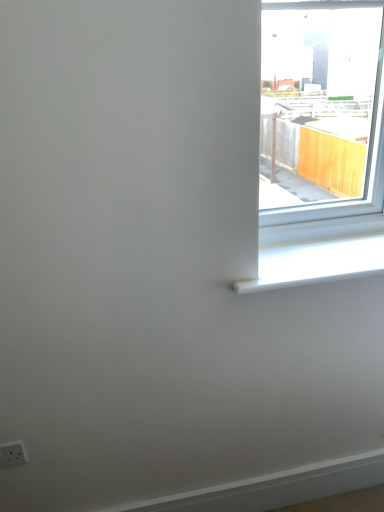
What do you see at coordinates (316, 262) in the screenshot? The image size is (384, 512). I see `white plastic window sill at upper right` at bounding box center [316, 262].

The image size is (384, 512). In order to click on white plastic window sill at upper right in this screenshot , I will do `click(316, 262)`.

This screenshot has height=512, width=384. What do you see at coordinates (12, 454) in the screenshot?
I see `white plastic electric outlet at lower left` at bounding box center [12, 454].

This screenshot has width=384, height=512. Find the location of `white plastic electric outlet at lower left`. white plastic electric outlet at lower left is located at coordinates (12, 454).

Where is `white plastic window sill at upper right`? The image size is (384, 512). white plastic window sill at upper right is located at coordinates (316, 262).

Considering the relative positions of white plastic window sill at upper right and white plastic electric outlet at lower left in the image provided, is white plastic window sill at upper right to the right of white plastic electric outlet at lower left from the viewer's perspective?

Indeed, white plastic window sill at upper right is positioned on the right side of white plastic electric outlet at lower left.

Who is more distant, white plastic window sill at upper right or white plastic electric outlet at lower left?

white plastic electric outlet at lower left is more distant.

Considering the positions of points (351, 241) and (21, 448), is point (351, 241) farther from camera compared to point (21, 448)?

Yes, it is.

From the image's perspective, which one is positioned higher, white plastic window sill at upper right or white plastic electric outlet at lower left?

white plastic window sill at upper right appears higher in the image.

Looking at this image, from a real-world perspective, is white plastic window sill at upper right on white plastic electric outlet at lower left?

Yes, from a real-world perspective, white plastic window sill at upper right is on top of white plastic electric outlet at lower left.

Which object is thinner, white plastic window sill at upper right or white plastic electric outlet at lower left?

white plastic electric outlet at lower left is thinner.

Considering the relative sizes of white plastic window sill at upper right and white plastic electric outlet at lower left in the image provided, is white plastic window sill at upper right shorter than white plastic electric outlet at lower left?

Yes.

Who is smaller, white plastic window sill at upper right or white plastic electric outlet at lower left?

white plastic electric outlet at lower left is smaller.

Is white plastic window sill at upper right not within white plastic electric outlet at lower left?

Indeed, white plastic window sill at upper right is completely outside white plastic electric outlet at lower left.

Is white plastic window sill at upper right beside white plastic electric outlet at lower left?

No, white plastic window sill at upper right is not making contact with white plastic electric outlet at lower left.

Is white plastic window sill at upper right aimed at white plastic electric outlet at lower left?

No, white plastic window sill at upper right is not facing towards white plastic electric outlet at lower left.

Can you tell me how much white plastic window sill at upper right and white plastic electric outlet at lower left differ in facing direction?

0.894 degrees.

Identify the location of electric outlet below the white plastic window sill at upper right (from a real-world perspective). This screenshot has height=512, width=384. (12, 454).

Considering the relative positions of white plastic electric outlet at lower left and white plastic window sill at upper right in the image provided, is white plastic electric outlet at lower left to the left or to the right of white plastic window sill at upper right?

Clearly, white plastic electric outlet at lower left is on the left of white plastic window sill at upper right in the image.

Considering the positions of objects white plastic electric outlet at lower left and white plastic window sill at upper right in the image provided, who is in front, white plastic electric outlet at lower left or white plastic window sill at upper right?

white plastic window sill at upper right is closer to the camera.

In the scene shown: Which is closer to the camera, (13, 464) or (375, 258)?

Point (13, 464) is closer to the camera than point (375, 258).

Based on the photo, from the image's perspective, which is below, white plastic electric outlet at lower left or white plastic window sill at upper right?

white plastic electric outlet at lower left appears lower in the image.

From a real-world perspective, who is located higher, white plastic electric outlet at lower left or white plastic window sill at upper right?

In real-world perspective, white plastic window sill at upper right is above.

Looking at their sizes, would you say white plastic electric outlet at lower left is wider or thinner than white plastic window sill at upper right?

Clearly, white plastic electric outlet at lower left has less width compared to white plastic window sill at upper right.

Considering the relative sizes of white plastic electric outlet at lower left and white plastic window sill at upper right in the image provided, is white plastic electric outlet at lower left shorter than white plastic window sill at upper right?

In fact, white plastic electric outlet at lower left may be taller than white plastic window sill at upper right.

Between white plastic electric outlet at lower left and white plastic window sill at upper right, which one has smaller size?

white plastic electric outlet at lower left.

Is white plastic electric outlet at lower left outside of white plastic window sill at upper right?

Yes, white plastic electric outlet at lower left is outside of white plastic window sill at upper right.

Are white plastic electric outlet at lower left and white plastic window sill at upper right beside each other?

No, white plastic electric outlet at lower left is not touching white plastic window sill at upper right.

Is white plastic electric outlet at lower left facing towards white plastic window sill at upper right?

No, white plastic electric outlet at lower left is not facing towards white plastic window sill at upper right.

The image size is (384, 512). Find the location of `electric outlet lying behind the white plastic window sill at upper right`. electric outlet lying behind the white plastic window sill at upper right is located at coordinates (12, 454).

Identify the location of window sill that appears on the right of white plastic electric outlet at lower left. (316, 262).

Where is `window sill above the white plastic electric outlet at lower left (from the image's perspective)`? window sill above the white plastic electric outlet at lower left (from the image's perspective) is located at coordinates (316, 262).